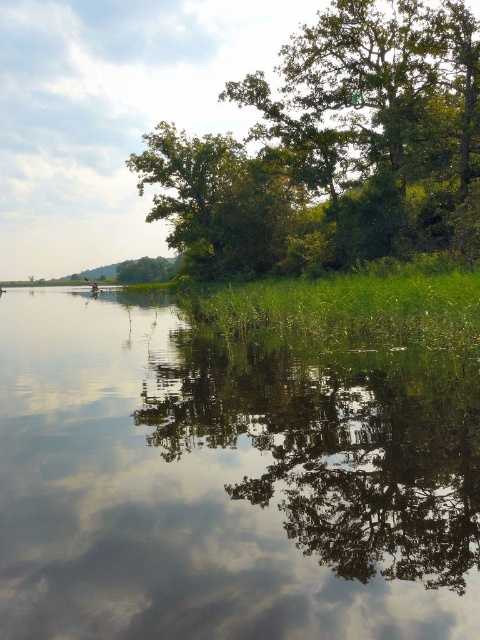
Is transparent water at center above green leafy tree at upper center?

Incorrect, transparent water at center is not positioned above green leafy tree at upper center.

Does transparent water at center come in front of green leafy tree at upper center?

Yes, transparent water at center is closer to the viewer.

The height and width of the screenshot is (640, 480). I want to click on transparent water at center, so click(x=227, y=483).

Locate an element on the screen. transparent water at center is located at coordinates (227, 483).